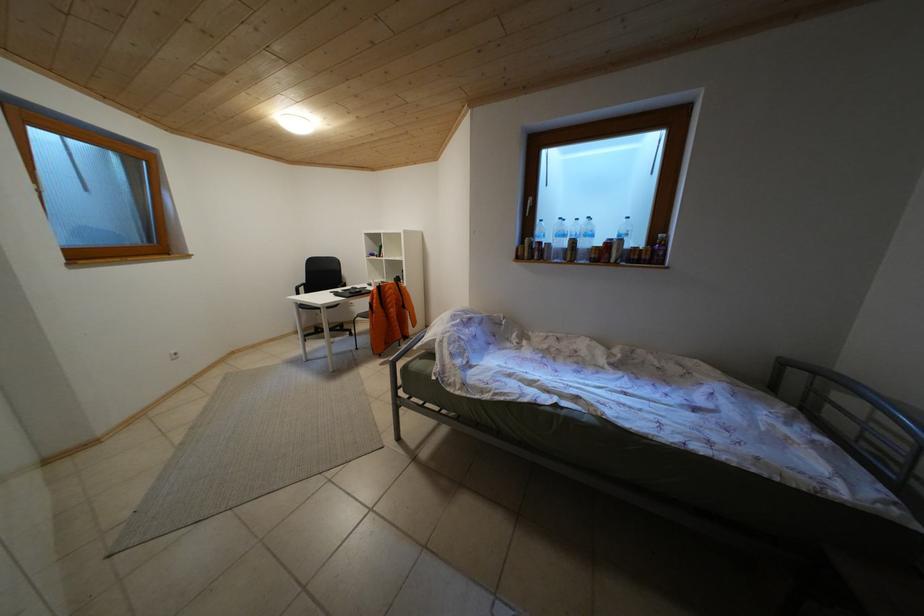
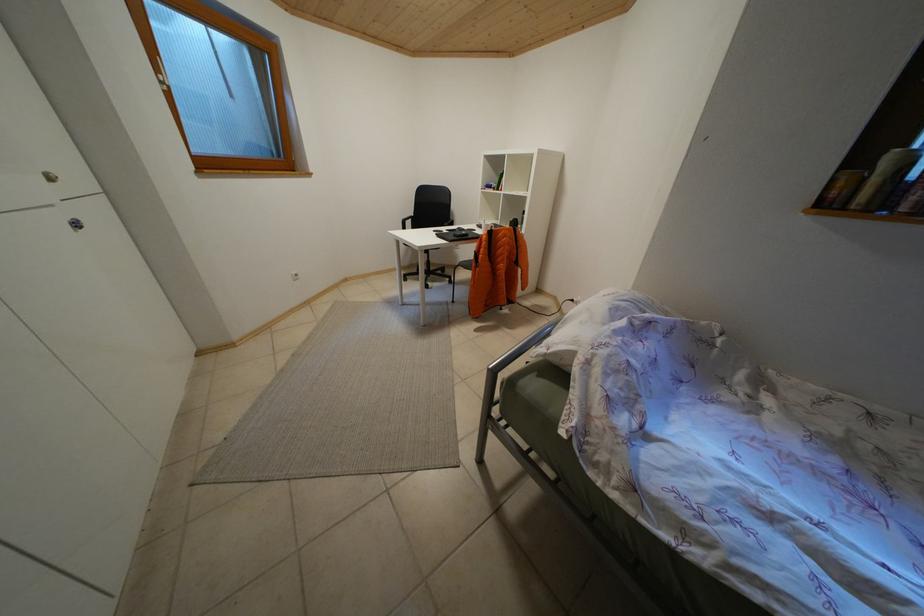
Question: The camera is either moving clockwise (left) or counter-clockwise (right) around the object. The first image is from the beginning of the video and the second image is from the end. Is the camera moving left or right when shooting the video?

Choices:
 (A) Left
 (B) Right

Answer: (B)